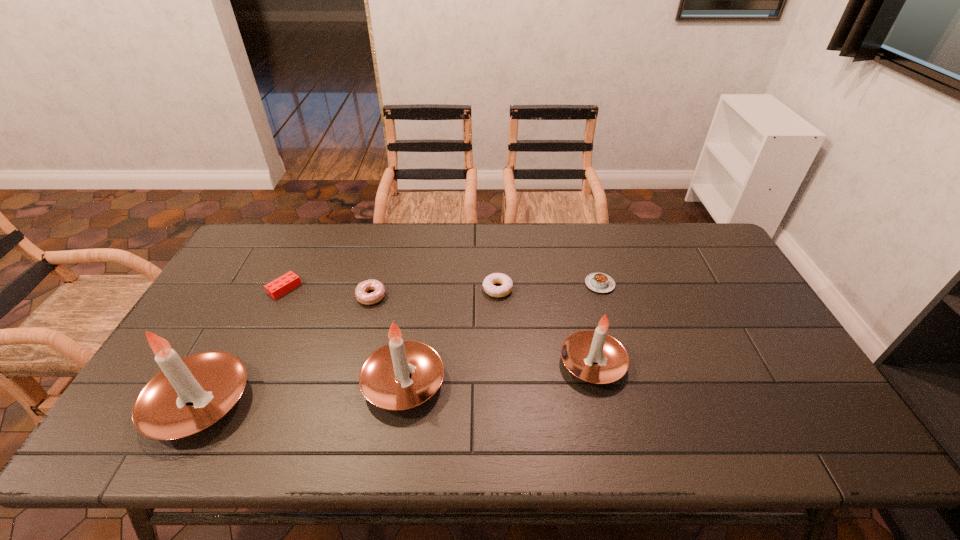
At what (x,y) coordinates should I click in order to perform the action: click on free region that satisfies the following two spatial constraints: 1. on the back side of the second tallest object; 2. on the right side of the third tallest object. Please return your answer as a coordinate pair (x, y). This screenshot has height=540, width=960. Looking at the image, I should click on (406, 363).

Find the location of a particular element. free location that satisfies the following two spatial constraints: 1. on the back side of the right doughnut; 2. on the right side of the left doughnut is located at coordinates (373, 289).